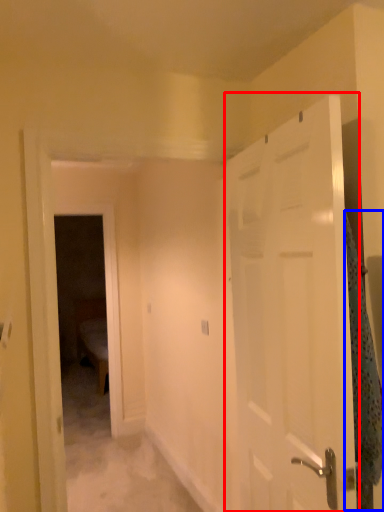
Question: Which object is closer to the camera taking this photo, door (highlighted by a red box) or blanket (highlighted by a blue box)?

Choices:
 (A) door
 (B) blanket

Answer: (A)